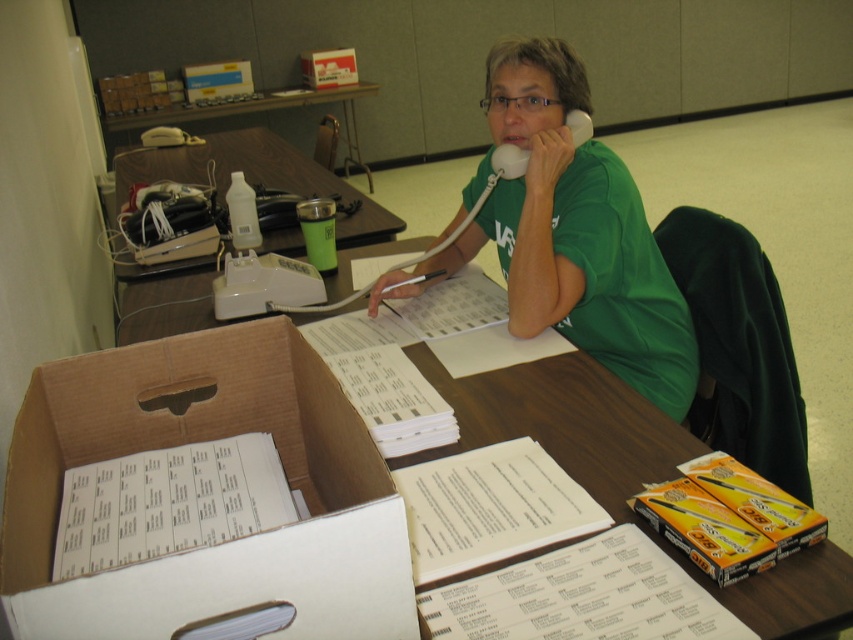
You are organizing items on the wooden table at upper center and the blue cardboard box at upper left. Based on their positions, which object is closer to you if you are facing the scene?

The wooden table at upper center is closer to you because it is in front of the blue cardboard box at upper left.

You are organizing the items on the table and need to place the white paper at center and the white cardboard box at upper center side by side. Which item should be placed first to ensure they fit without overlapping?

The white paper at center has a larger width than the white cardboard box at upper center, so place the white paper at center first to accommodate its greater width, then position the white cardboard box at upper center next to it.

You are organizing the items on the wooden table at upper center. You need to place the white plastic telephone at upper left somewhere on the table. Considering their sizes, which object should you move to make space?

The white plastic telephone at upper left is larger than the wooden table at upper center, so it might not fit on the table without removing some items. However, since the table is already occupied with multiple items like papers, a book, a cardboard box, a cup, a bottle, and other objects, you should consider moving the largest or bulkiest item first, such as the cardboard box containing more papers or the large open book, to create enough space for the telephone.